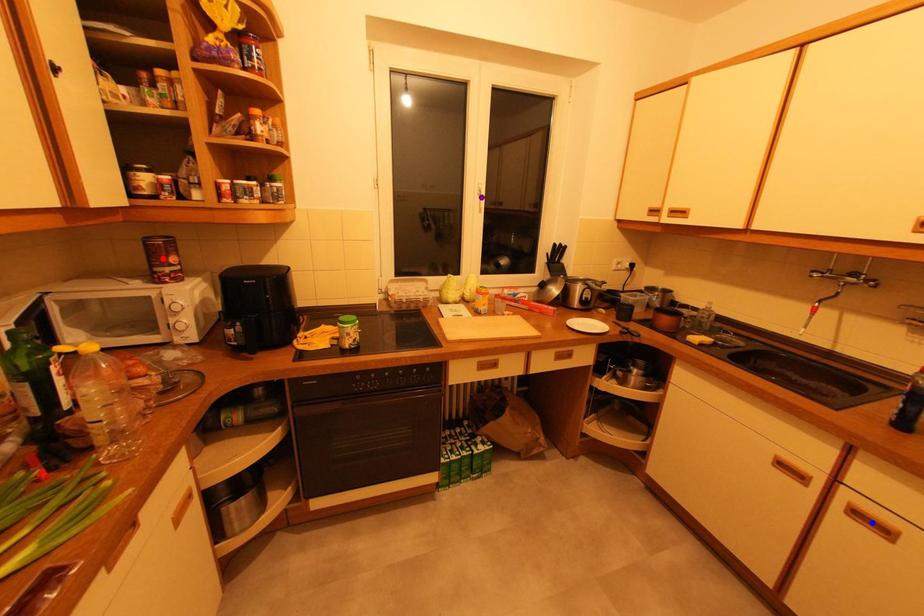
Order these from nearest to farthest:
1. red point
2. blue point
3. purple point

blue point < red point < purple point